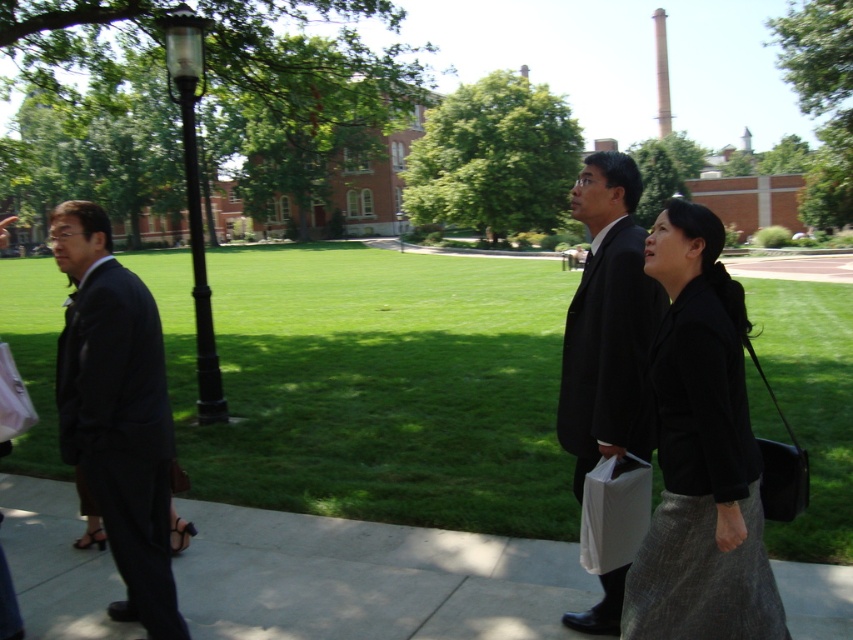
You are standing at the starting point and see two points marked on the pathway in the foreground. The first point is at coordinates point [131,516] and the second at point [606,618]. Which point is closer to you?

Point [131,516] is in front of point [606,618], so the first point is closer to you.

You are standing at the point marked by coordinates point (375, 385) in the image. What surface are you currently standing on?

The point (375, 385) is on green grass at center, so you are standing on green grass.

You are a maintenance worker on campus and need to mow the green grass at center. Can you drive your lawnmower over the concrete sidewalk at lower center to reach the grass?

The green grass at center has a greater height compared to concrete sidewalk at lower center. Yes, you can drive your lawnmower over the concrete sidewalk at lower center to reach the grass since the sidewalk is lower than the grass area.